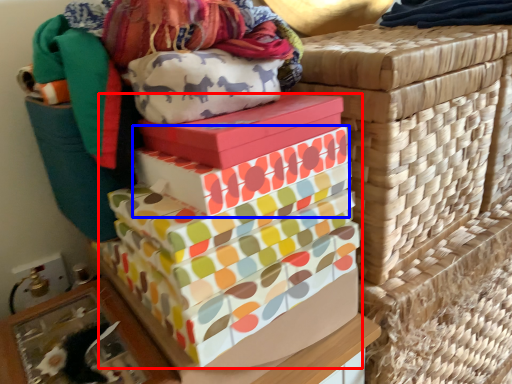
Question: Which object appears closest to the camera in this image, gift box (highlighted by a red box) or gift box (highlighted by a blue box)?

Choices:
 (A) gift box
 (B) gift box

Answer: (A)